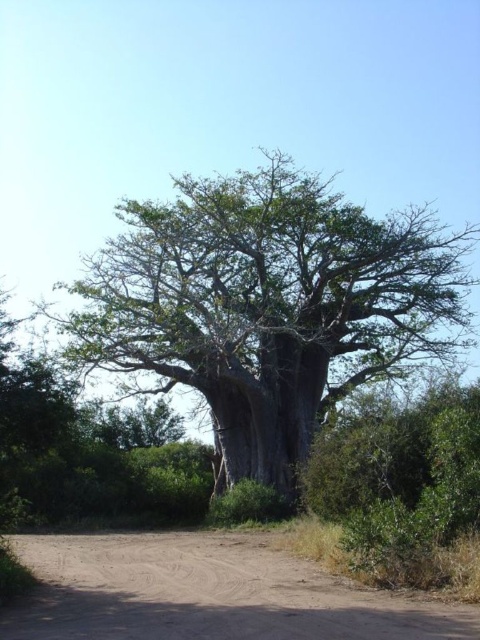
Is green rough bark tree at center taller than brown sandy dirt track at lower center?

Yes.

Does green rough bark tree at center appear on the right side of brown sandy dirt track at lower center?

No, green rough bark tree at center is not to the right of brown sandy dirt track at lower center.

Is point (83, 280) in front of point (385, 634)?

No, it is behind (385, 634).

What are the coordinates of `green rough bark tree at center` in the screenshot? It's located at (268, 305).